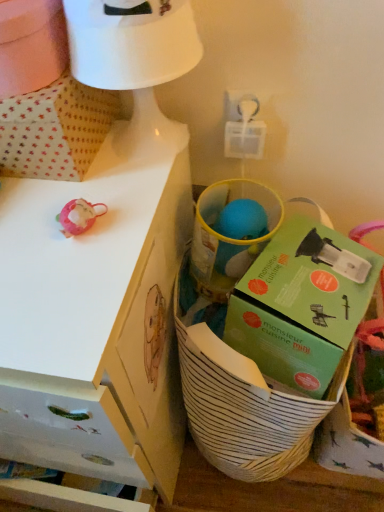
Question: From a real-world perspective, does white matte desk at upper left stand above green cardboard box at center?

Choices:
 (A) yes
 (B) no

Answer: (B)

Question: Can you confirm if white matte desk at upper left is bigger than green cardboard box at center?

Choices:
 (A) yes
 (B) no

Answer: (A)

Question: From the image's perspective, is white matte desk at upper left over green cardboard box at center?

Choices:
 (A) no
 (B) yes

Answer: (A)

Question: Considering the relative positions of white matte desk at upper left and green cardboard box at center in the image provided, is white matte desk at upper left to the left of green cardboard box at center from the viewer's perspective?

Choices:
 (A) no
 (B) yes

Answer: (B)

Question: Is white matte desk at upper left closer to camera compared to green cardboard box at center?

Choices:
 (A) yes
 (B) no

Answer: (A)

Question: Is white matte desk at upper left taller than green cardboard box at center?

Choices:
 (A) no
 (B) yes

Answer: (B)

Question: Is white matte desk at upper left not near white striped basket at lower right?

Choices:
 (A) no
 (B) yes

Answer: (A)

Question: Is white matte desk at upper left taller than white striped basket at lower right?

Choices:
 (A) no
 (B) yes

Answer: (B)

Question: Can you confirm if white matte desk at upper left is wider than white striped basket at lower right?

Choices:
 (A) yes
 (B) no

Answer: (A)

Question: Is white matte desk at upper left surrounding white striped basket at lower right?

Choices:
 (A) no
 (B) yes

Answer: (A)

Question: Is white matte desk at upper left next to white striped basket at lower right and touching it?

Choices:
 (A) no
 (B) yes

Answer: (A)

Question: Is white matte desk at upper left at the right side of white striped basket at lower right?

Choices:
 (A) yes
 (B) no

Answer: (B)

Question: Does white dotted fabric at upper left have a greater width compared to white striped basket at lower right?

Choices:
 (A) yes
 (B) no

Answer: (B)